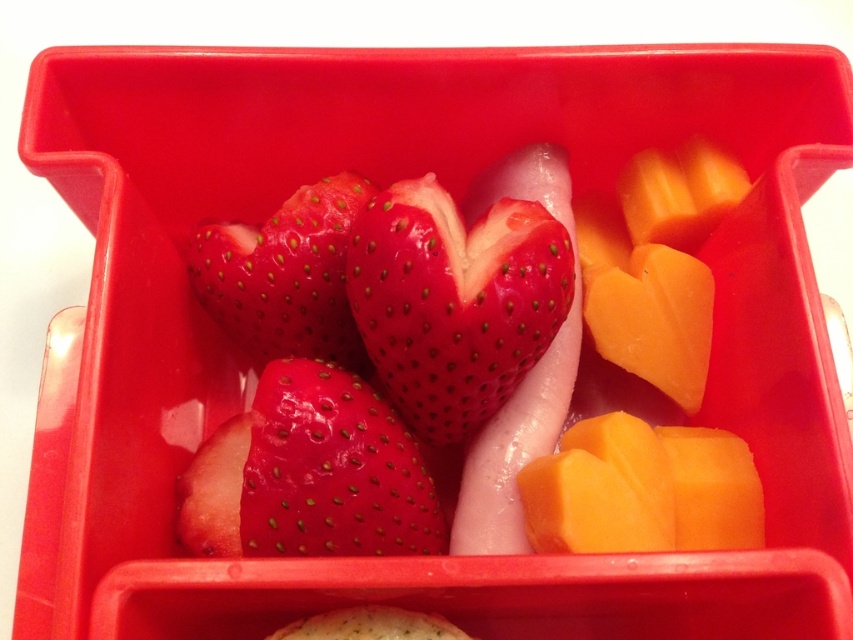
You are a food delivery robot that needs to pick up an item from the shiny red strawberry at center. The robot has a claw that can only reach a certain point. Is the point at coordinates [454,300] on the shiny red strawberry at center?

Yes, the point at coordinates [454,300] is on the shiny red strawberry at center, so the robot can use its claw to pick up the item from there.

In the image, you see a smooth red strawberry at center. Where exactly is it located in terms of coordinates?

The smooth red strawberry at center is located at point coordinates of (332, 470).

You are a food stylist arranging a photo shoot. You need to ensure that the shiny red strawberries at center are visible above the glossy red strawberry at center. Based on the image description, can you confirm if this is already the case?

The shiny red strawberries at center are taller than the glossy red strawberry at center, so they are already visible above it.